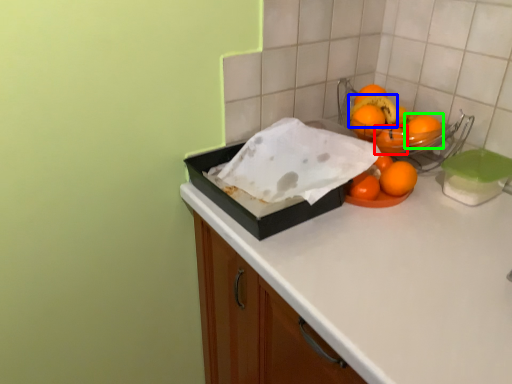
Question: Considering the real-world distances, which object is closest to orange (highlighted by a red box)? fruit (highlighted by a blue box) or orange (highlighted by a green box).

Choices:
 (A) fruit
 (B) orange

Answer: (B)